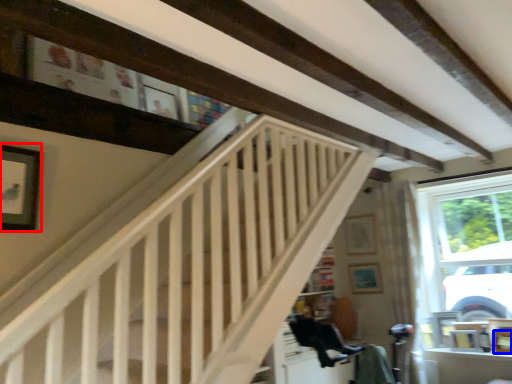
Question: Which point is closer to the camera, picture frame (highlighted by a red box) or picture frame (highlighted by a blue box)?

Choices:
 (A) picture frame
 (B) picture frame

Answer: (A)